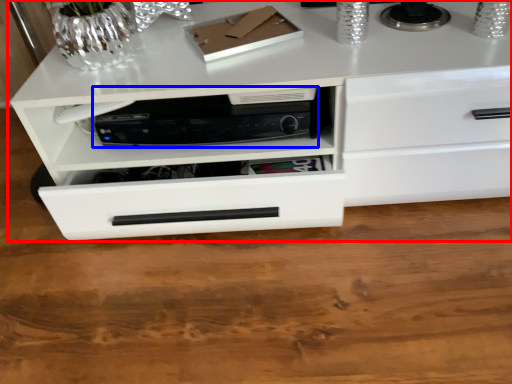
Question: Among these objects, which one is nearest to the camera, chest of drawers (highlighted by a red box) or home appliance (highlighted by a blue box)?

Choices:
 (A) chest of drawers
 (B) home appliance

Answer: (A)